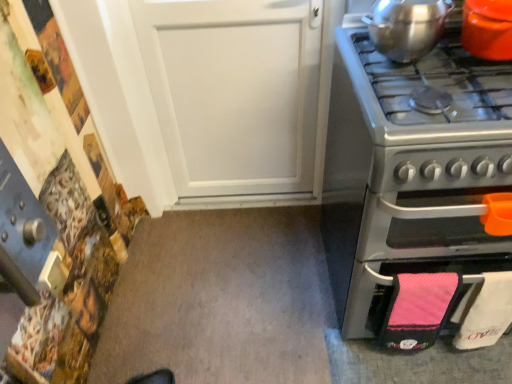
Question: Is shiny metallic pot at upper right, the first kitchen appliance positioned from the left, wider than stainless steel oven at right?

Choices:
 (A) no
 (B) yes

Answer: (A)

Question: Does shiny metallic pot at upper right, positioned as the 2th kitchen appliance in right-to-left order, have a lesser width compared to stainless steel oven at right?

Choices:
 (A) yes
 (B) no

Answer: (A)

Question: Considering the relative sizes of shiny metallic pot at upper right, the first kitchen appliance positioned from the left, and stainless steel oven at right in the image provided, is shiny metallic pot at upper right, the first kitchen appliance positioned from the left, smaller than stainless steel oven at right?

Choices:
 (A) yes
 (B) no

Answer: (A)

Question: Can you confirm if shiny metallic pot at upper right, positioned as the 2th kitchen appliance in right-to-left order, is taller than stainless steel oven at right?

Choices:
 (A) no
 (B) yes

Answer: (A)

Question: Would you say stainless steel oven at right is part of shiny metallic pot at upper right, the first kitchen appliance positioned from the left,'s contents?

Choices:
 (A) yes
 (B) no

Answer: (B)

Question: From a real-world perspective, is shiny metallic pot at upper right, the first kitchen appliance positioned from the left, on stainless steel oven at right?

Choices:
 (A) yes
 (B) no

Answer: (A)

Question: Considering the relative sizes of orange glossy pot at upper right, which ranks as the second kitchen appliance in left-to-right order, and stainless steel oven at right in the image provided, is orange glossy pot at upper right, which ranks as the second kitchen appliance in left-to-right order, taller than stainless steel oven at right?

Choices:
 (A) no
 (B) yes

Answer: (A)

Question: Is orange glossy pot at upper right, positioned as the 1th kitchen appliance in right-to-left order, at the left side of stainless steel oven at right?

Choices:
 (A) no
 (B) yes

Answer: (A)

Question: Is orange glossy pot at upper right, which ranks as the second kitchen appliance in left-to-right order, outside of stainless steel oven at right?

Choices:
 (A) yes
 (B) no

Answer: (A)

Question: Can you confirm if orange glossy pot at upper right, which ranks as the second kitchen appliance in left-to-right order, is thinner than stainless steel oven at right?

Choices:
 (A) no
 (B) yes

Answer: (B)

Question: Considering the relative positions of orange glossy pot at upper right, which ranks as the second kitchen appliance in left-to-right order, and stainless steel oven at right in the image provided, is orange glossy pot at upper right, which ranks as the second kitchen appliance in left-to-right order, behind stainless steel oven at right?

Choices:
 (A) no
 (B) yes

Answer: (B)

Question: Is stainless steel oven at right positioned in front of shiny metallic pot at upper right, the first kitchen appliance positioned from the left?

Choices:
 (A) yes
 (B) no

Answer: (A)